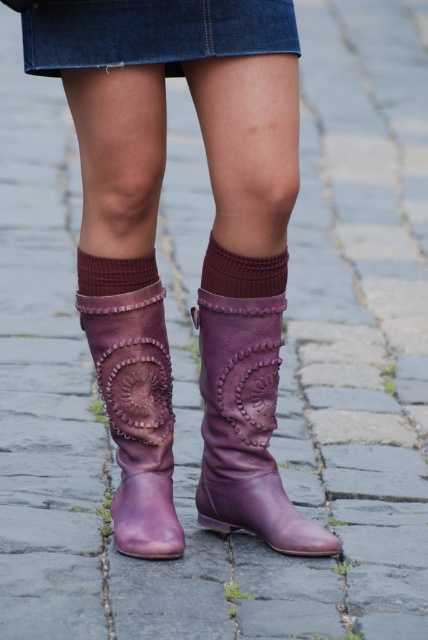
Is purple leather boot at lower center further to camera compared to maroon knitted sock at center?

No.

From the picture: Who is taller, purple leather boot at lower center or maroon knitted sock at center?

Standing taller between the two is purple leather boot at lower center.

You are a GUI agent. You are given a task and a screenshot of the screen. Output one action in this format:
    pyautogui.click(x=<x>, y=<y>)
    Task: Click on the purple leather boot at lower center
    Image resolution: width=428 pixels, height=640 pixels.
    Given the screenshot: What is the action you would take?
    pyautogui.click(x=136, y=416)

Who is taller, purple leather cowboy boot at center or maroon knitted sock at center?

purple leather cowboy boot at center

This screenshot has width=428, height=640. What do you see at coordinates (246, 426) in the screenshot? I see `purple leather cowboy boot at center` at bounding box center [246, 426].

Does point (228, 419) come behind point (240, 296)?

Yes, it is behind point (240, 296).

Where is `purple leather cowboy boot at center`? This screenshot has height=640, width=428. purple leather cowboy boot at center is located at coordinates pos(246,426).

From the picture: Does purple leather boot at lower center have a lesser width compared to denim skirt at upper center?

Indeed, purple leather boot at lower center has a lesser width compared to denim skirt at upper center.

Does purple leather boot at lower center appear over denim skirt at upper center?

No.

Does point (143, 433) come closer to viewer compared to point (181, 8)?

No, (143, 433) is behind (181, 8).

Find the location of a particular element. The image size is (428, 640). purple leather boot at lower center is located at coordinates (136, 416).